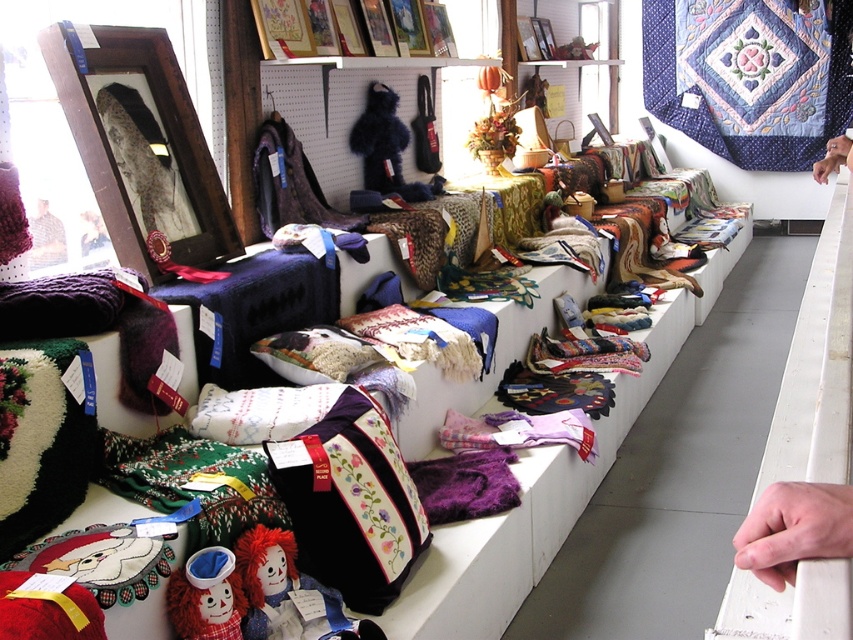
Is fuzzy fur coat at left to the left of fluffy fabric doll at lower left from the viewer's perspective?

Indeed, fuzzy fur coat at left is positioned on the left side of fluffy fabric doll at lower left.

Is point (186, 234) farther from camera compared to point (199, 600)?

Yes, point (186, 234) is farther from viewer.

Identify the location of fuzzy fur coat at left. click(144, 163).

Where is `fluffy fabric doll at lower left`? The width and height of the screenshot is (853, 640). fluffy fabric doll at lower left is located at coordinates (206, 596).

Looking at this image, does fluffy fabric doll at lower left have a larger size compared to smooth skin hand at upper right?

No.

Between point (218, 552) and point (837, 160), which one is positioned behind?

Point (837, 160)

Locate an element on the screen. fluffy fabric doll at lower left is located at coordinates (206, 596).

Can you confirm if smooth skin hand at lower right is wider than fuzzy fur coat at left?

In fact, smooth skin hand at lower right might be narrower than fuzzy fur coat at left.

Where is `smooth skin hand at lower right`? The image size is (853, 640). smooth skin hand at lower right is located at coordinates (793, 529).